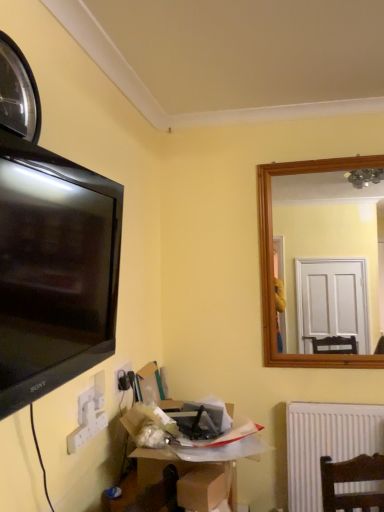
The image size is (384, 512). Describe the element at coordinates (326, 444) in the screenshot. I see `white ribbed radiator at lower right` at that location.

The height and width of the screenshot is (512, 384). I want to click on cardboard box at lower center, which appears as the 1th cardboard box when viewed from the back, so click(x=196, y=469).

Is matte black tv at left with cardboard box at lower center, the second cardboard box from the front?

They are not placed beside each other.

Is matte black tv at left looking in the opposite direction of cardboard box at lower center, the second cardboard box from the front?

No, cardboard box at lower center, the second cardboard box from the front, is not at the back of matte black tv at left.

Is matte black tv at left outside of cardboard box at lower center, which appears as the 1th cardboard box when viewed from the back?

Yes, matte black tv at left is outside of cardboard box at lower center, which appears as the 1th cardboard box when viewed from the back.

Is point (64, 353) behind point (197, 505)?

No.

Between metallic reflective clock at upper left and white plastic electric outlet at lower left, which one has smaller size?

Smaller between the two is white plastic electric outlet at lower left.

The width and height of the screenshot is (384, 512). I want to click on electric outlet behind the metallic reflective clock at upper left, so click(124, 378).

Is metallic reflective clock at upper left with white plastic electric outlet at lower left?

metallic reflective clock at upper left and white plastic electric outlet at lower left are not in contact.

From the image's perspective, is matte black tv at left above white plastic electric outlet at lower left?

Yes, from the image's perspective, matte black tv at left is over white plastic electric outlet at lower left.

Can you confirm if matte black tv at left is shorter than white plastic electric outlet at lower left?

Incorrect, the height of matte black tv at left does not fall short of that of white plastic electric outlet at lower left.

Is matte black tv at left closer to the viewer compared to white plastic electric outlet at lower left?

Yes, matte black tv at left is closer to the viewer.

From a real-world perspective, is matte black tv at left below white plastic electric outlet at lower left?

No.

From the image's perspective, which one is positioned higher, brown cardboard box at lower center, which is the second cardboard box in back-to-front order, or metallic reflective clock at upper left?

metallic reflective clock at upper left is shown above in the image.

Which is behind, point (199, 497) or point (0, 72)?

The point (199, 497) is more distant.

Is brown cardboard box at lower center, the first cardboard box positioned from the front, wider than metallic reflective clock at upper left?

Yes, brown cardboard box at lower center, the first cardboard box positioned from the front, is wider than metallic reflective clock at upper left.

Is point (76, 273) closer or farther from the camera than point (305, 450)?

Point (76, 273) is closer to the camera than point (305, 450).

Between matte black tv at left and white ribbed radiator at lower right, which one has larger size?

With larger size is matte black tv at left.

Where is `television in front of the white ribbed radiator at lower right`? Image resolution: width=384 pixels, height=512 pixels. television in front of the white ribbed radiator at lower right is located at coordinates [54, 270].

Considering the sizes of matte black tv at left and white ribbed radiator at lower right in the image, is matte black tv at left wider or thinner than white ribbed radiator at lower right?

matte black tv at left is wider than white ribbed radiator at lower right.

This screenshot has height=512, width=384. I want to click on the 2nd cardboard box below when counting from the metallic reflective clock at upper left (from the image's perspective), so click(x=201, y=489).

Can we say metallic reflective clock at upper left lies outside brown cardboard box at lower center, the first cardboard box positioned from the front?

Absolutely, metallic reflective clock at upper left is external to brown cardboard box at lower center, the first cardboard box positioned from the front.

Is metallic reflective clock at upper left wider or thinner than brown cardboard box at lower center, the first cardboard box positioned from the front?

Considering their sizes, metallic reflective clock at upper left looks slimmer than brown cardboard box at lower center, the first cardboard box positioned from the front.

From the image's perspective, which is below, metallic reflective clock at upper left or brown cardboard box at lower center, the first cardboard box positioned from the front?

brown cardboard box at lower center, the first cardboard box positioned from the front, is shown below in the image.

How different are the orientations of cardboard box at lower center, the second cardboard box from the front, and matte black tv at left in degrees?

They differ by 1.08 degrees in their facing directions.

Does point (194, 455) lie behind point (39, 348)?

Yes, point (194, 455) is behind point (39, 348).

In the image, is cardboard box at lower center, the second cardboard box from the front, on the left side or the right side of matte black tv at left?

In the image, cardboard box at lower center, the second cardboard box from the front, appears on the right side of matte black tv at left.

Are cardboard box at lower center, which appears as the 1th cardboard box when viewed from the back, and matte black tv at left beside each other?

They are not placed beside each other.

From a real-world perspective, which cardboard box is the 1st one underneath the matte black tv at left? Please provide its 2D coordinates.

[(196, 469)]

Where is `electric outlet behind the metallic reflective clock at upper left`? This screenshot has width=384, height=512. electric outlet behind the metallic reflective clock at upper left is located at coordinates (124, 378).

Estimate the real-world distances between objects in this image. Which object is further from white plastic electric outlet at lower left, cardboard box at lower center, the second cardboard box from the front, or white ribbed radiator at lower right?

white ribbed radiator at lower right is further to white plastic electric outlet at lower left.

Looking at the image, which one is located further to cardboard box at lower center, the second cardboard box from the front, white plastic electric outlet at lower left or metallic reflective clock at upper left?

metallic reflective clock at upper left is positioned further to the anchor cardboard box at lower center, the second cardboard box from the front.

Looking at the image, which one is located further to matte black tv at left, metallic reflective clock at upper left or white ribbed radiator at lower right?

The object further to matte black tv at left is white ribbed radiator at lower right.

When comparing their distances from brown cardboard box at lower center, which is the second cardboard box in back-to-front order, does cardboard box at lower center, the second cardboard box from the front, or metallic reflective clock at upper left seem closer?

cardboard box at lower center, the second cardboard box from the front.

From the image, which object appears to be nearer to cardboard box at lower center, the second cardboard box from the front, matte black tv at left or brown cardboard box at lower center, the first cardboard box positioned from the front?

The object closer to cardboard box at lower center, the second cardboard box from the front, is brown cardboard box at lower center, the first cardboard box positioned from the front.

When comparing their distances from metallic reflective clock at upper left, does brown cardboard box at lower center, which is the second cardboard box in back-to-front order, or white plastic electric outlet at lower left seem further?

brown cardboard box at lower center, which is the second cardboard box in back-to-front order.

Which object lies nearer to the anchor point cardboard box at lower center, the second cardboard box from the front, brown cardboard box at lower center, which is the second cardboard box in back-to-front order, or metallic reflective clock at upper left?

brown cardboard box at lower center, which is the second cardboard box in back-to-front order.

Estimate the real-world distances between objects in this image. Which object is further from brown cardboard box at lower center, the first cardboard box positioned from the front, metallic reflective clock at upper left or white ribbed radiator at lower right?

Based on the image, metallic reflective clock at upper left appears to be further to brown cardboard box at lower center, the first cardboard box positioned from the front.

Where is `television between metallic reflective clock at upper left and brown cardboard box at lower center, which is the second cardboard box in back-to-front order, from top to bottom`? This screenshot has width=384, height=512. television between metallic reflective clock at upper left and brown cardboard box at lower center, which is the second cardboard box in back-to-front order, from top to bottom is located at coordinates (54, 270).

I want to click on cardboard box between brown cardboard box at lower center, which is the second cardboard box in back-to-front order, and white plastic electric outlet at lower left in the front-back direction, so click(x=196, y=469).

In order to click on electric outlet between metallic reflective clock at upper left and white ribbed radiator at lower right vertically in this screenshot , I will do `click(124, 378)`.

Locate an element on the screen. electric outlet between matte black tv at left and white ribbed radiator at lower right along the z-axis is located at coordinates (124, 378).